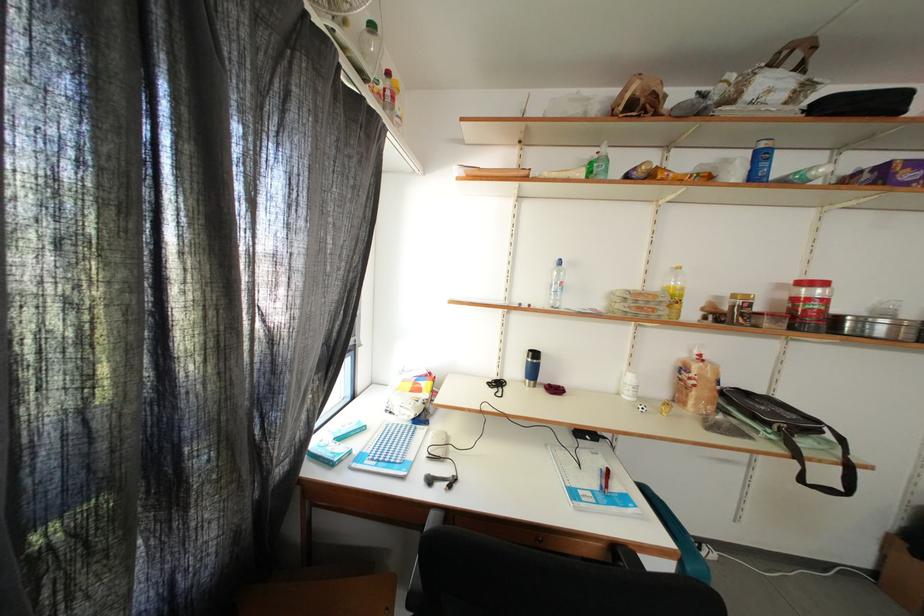
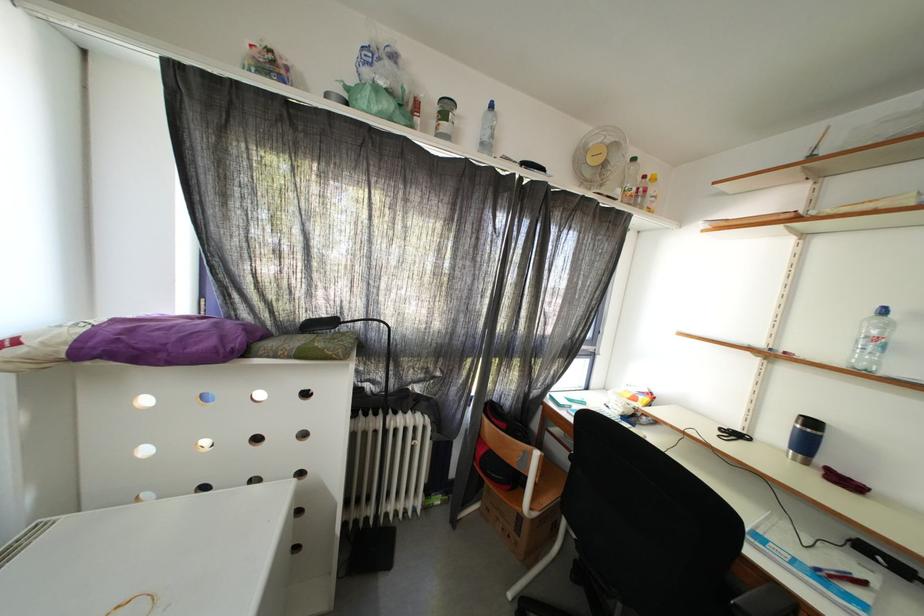
In the second image, find the point that corresponds to (542,360) in the first image.

(820, 429)